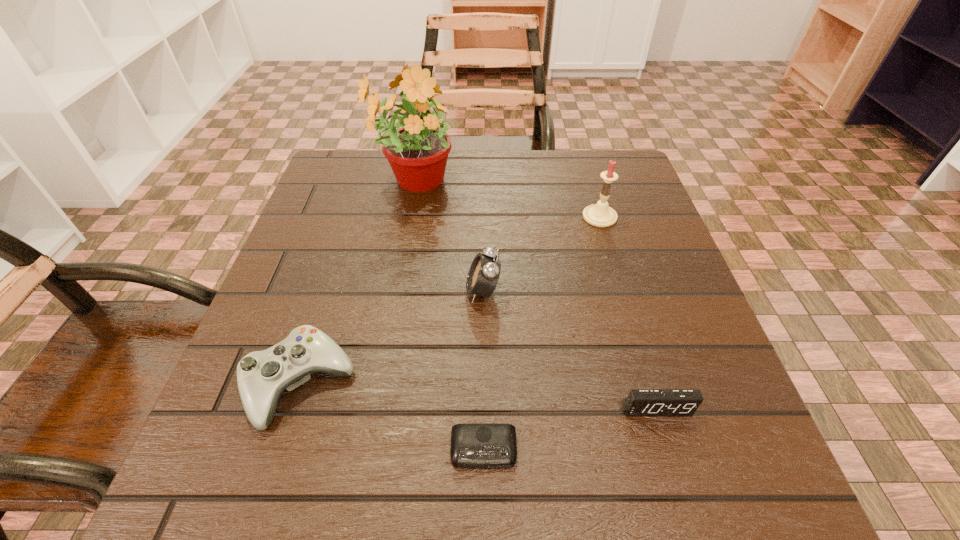
Where is `flowerpot`? flowerpot is located at coordinates (417, 152).

The height and width of the screenshot is (540, 960). Find the location of `the second tallest object`. the second tallest object is located at coordinates (600, 215).

The height and width of the screenshot is (540, 960). Identify the location of the third tallest object. (484, 272).

You are a GUI agent. You are given a task and a screenshot of the screen. Output one action in this format:
    pyautogui.click(x=<x>, y=<y>)
    Task: Click on the farthest alarm clock
    
    Given the screenshot: What is the action you would take?
    pyautogui.click(x=484, y=272)

Find the location of a particular element. This screenshot has height=540, width=960. the fourth tallest object is located at coordinates (262, 376).

Image resolution: width=960 pixels, height=540 pixels. What are the coordinates of `the fifth tallest object` in the screenshot? It's located at [x=640, y=402].

The image size is (960, 540). I want to click on the second nearest alarm clock, so click(x=640, y=402).

Find the location of a particular element. The width and height of the screenshot is (960, 540). the shortest object is located at coordinates pos(473,445).

This screenshot has width=960, height=540. I want to click on the shortest alarm clock, so click(x=473, y=445).

Identify the location of vacant position located 0.100m on the front of the tallest object. (401, 240).